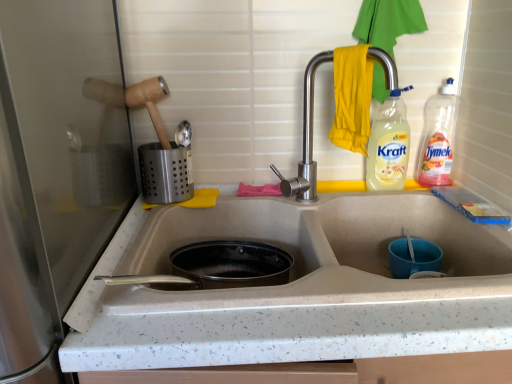
Question: Is the position of clear plastic bottle at upper right, which ranks as the 1th bottle in right-to-left order, less distant than that of yellow fabric hand towel at upper right?

Choices:
 (A) yes
 (B) no

Answer: (B)

Question: Is clear plastic bottle at upper right, which ranks as the 1th bottle in right-to-left order, outside yellow fabric hand towel at upper right?

Choices:
 (A) no
 (B) yes

Answer: (B)

Question: From the image's perspective, is clear plastic bottle at upper right, which is the second bottle from left to right, on top of yellow fabric hand towel at upper right?

Choices:
 (A) yes
 (B) no

Answer: (B)

Question: From the image's perspective, would you say clear plastic bottle at upper right, which is the second bottle from left to right, is shown under yellow fabric hand towel at upper right?

Choices:
 (A) no
 (B) yes

Answer: (B)

Question: Does clear plastic bottle at upper right, which is the second bottle from left to right, have a lesser width compared to yellow fabric hand towel at upper right?

Choices:
 (A) yes
 (B) no

Answer: (B)

Question: Does clear plastic bottle at upper right, which ranks as the 1th bottle in right-to-left order, have a greater width compared to yellow fabric hand towel at upper right?

Choices:
 (A) no
 (B) yes

Answer: (B)

Question: From a real-world perspective, is translucent plastic bottle at upper right, the second bottle in the right-to-left sequence, physically above satin silver utensil holder at upper left, which ranks as the 2th appliance in front-to-back order?

Choices:
 (A) no
 (B) yes

Answer: (B)

Question: From the image's perspective, is translucent plastic bottle at upper right, the second bottle in the right-to-left sequence, over satin silver utensil holder at upper left, positioned as the second appliance in left-to-right order?

Choices:
 (A) yes
 (B) no

Answer: (A)

Question: Considering the relative sizes of translucent plastic bottle at upper right, which is the 1th bottle from left to right, and satin silver utensil holder at upper left, the first appliance in the back-to-front sequence, in the image provided, is translucent plastic bottle at upper right, which is the 1th bottle from left to right, smaller than satin silver utensil holder at upper left, the first appliance in the back-to-front sequence,?

Choices:
 (A) yes
 (B) no

Answer: (A)

Question: Could you tell me if translucent plastic bottle at upper right, the second bottle in the right-to-left sequence, is facing satin silver utensil holder at upper left, which ranks as the 2th appliance in front-to-back order?

Choices:
 (A) no
 (B) yes

Answer: (A)

Question: From a real-world perspective, is translucent plastic bottle at upper right, which is the 1th bottle from left to right, under satin silver utensil holder at upper left, which ranks as the 2th appliance in front-to-back order?

Choices:
 (A) yes
 (B) no

Answer: (B)

Question: Is translucent plastic bottle at upper right, which is the 1th bottle from left to right, in contact with satin silver utensil holder at upper left, positioned as the second appliance in left-to-right order?

Choices:
 (A) yes
 (B) no

Answer: (B)

Question: Would you say white speckled countertop at left, the first appliance when ordered from bottom to top, is a long distance from satin silver utensil holder at upper left, the first appliance in the back-to-front sequence?

Choices:
 (A) no
 (B) yes

Answer: (A)